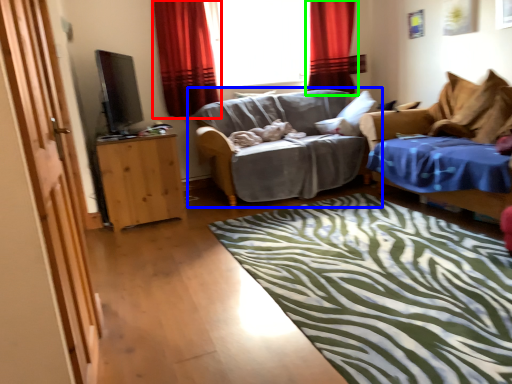
Question: Estimate the real-world distances between objects in this image. Which object is closer to curtain (highlighted by a red box), studio couch (highlighted by a blue box) or curtain (highlighted by a green box)?

Choices:
 (A) studio couch
 (B) curtain

Answer: (A)